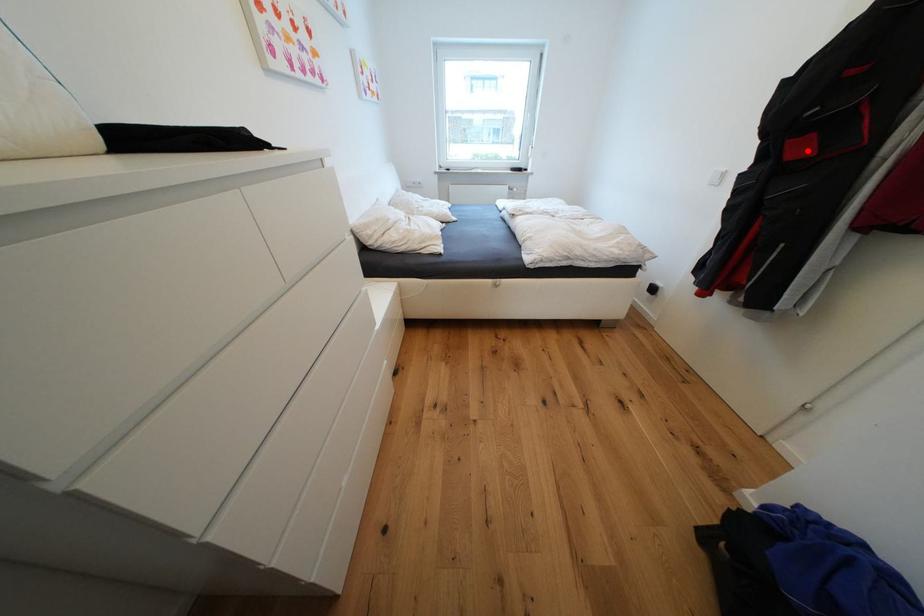
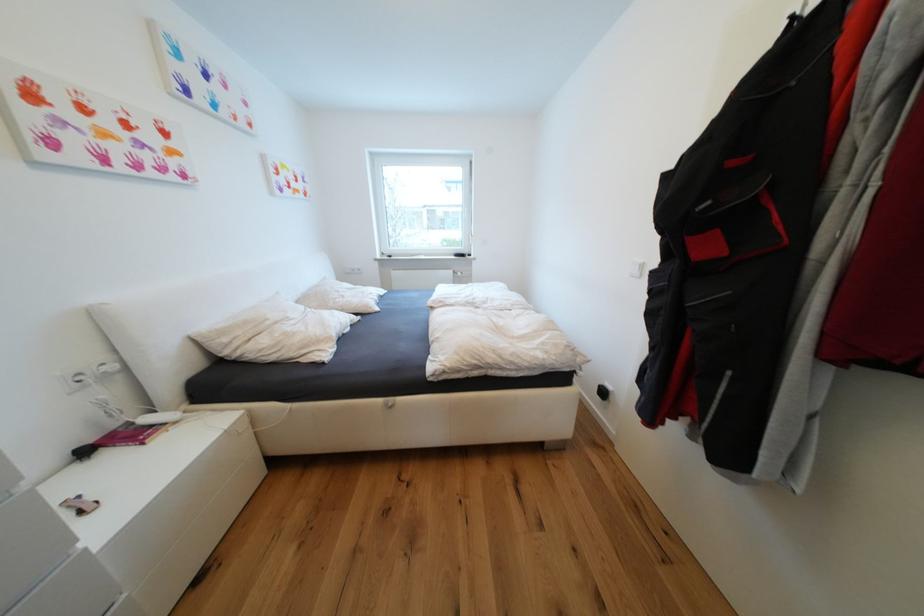
The point at the highlighted location is marked in the first image. Where is the corresponding point in the second image?

(714, 249)